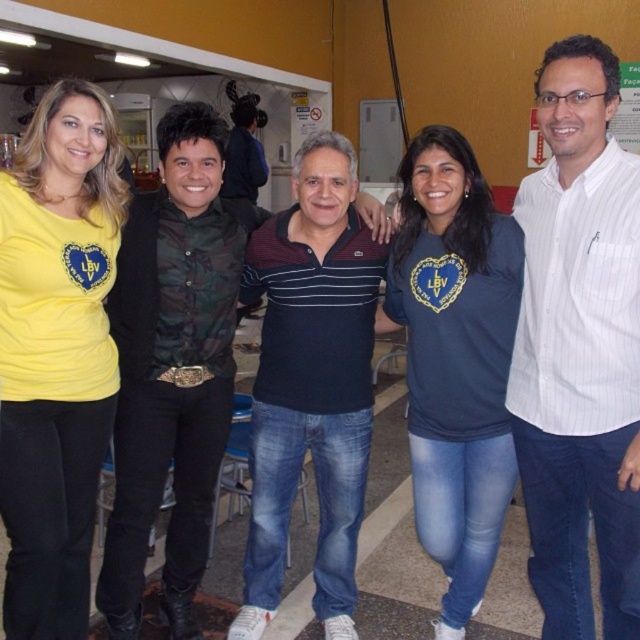
Is yellow matte shirt at left wider than dark blue t-shirt at center?

In fact, yellow matte shirt at left might be narrower than dark blue t-shirt at center.

Which is more to the right, yellow matte shirt at left or dark blue t-shirt at center?

Positioned to the right is dark blue t-shirt at center.

I want to click on yellow matte shirt at left, so (x=56, y=353).

Identify the location of yellow matte shirt at left. (56, 353).

The width and height of the screenshot is (640, 640). Describe the element at coordinates (579, 346) in the screenshot. I see `white striped shirt at center` at that location.

Is point (596, 493) closer to camera compared to point (410, 362)?

Yes, point (596, 493) is in front of point (410, 362).

You are a GUI agent. You are given a task and a screenshot of the screen. Output one action in this format:
    pyautogui.click(x=<x>, y=<y>)
    Task: Click on the white striped shirt at center
    The image size is (640, 640).
    Given the screenshot: What is the action you would take?
    pyautogui.click(x=579, y=346)

Who is positioned more to the right, yellow matte shirt at left or camouflage fabric shirt at left?

camouflage fabric shirt at left

Is point (115, 252) behind point (163, 145)?

No, (115, 252) is in front of (163, 145).

At what (x,y) coordinates should I click in order to perform the action: click on yellow matte shirt at left. Please return your answer as a coordinate pair (x, y). Image resolution: width=640 pixels, height=640 pixels. Looking at the image, I should click on (56, 353).